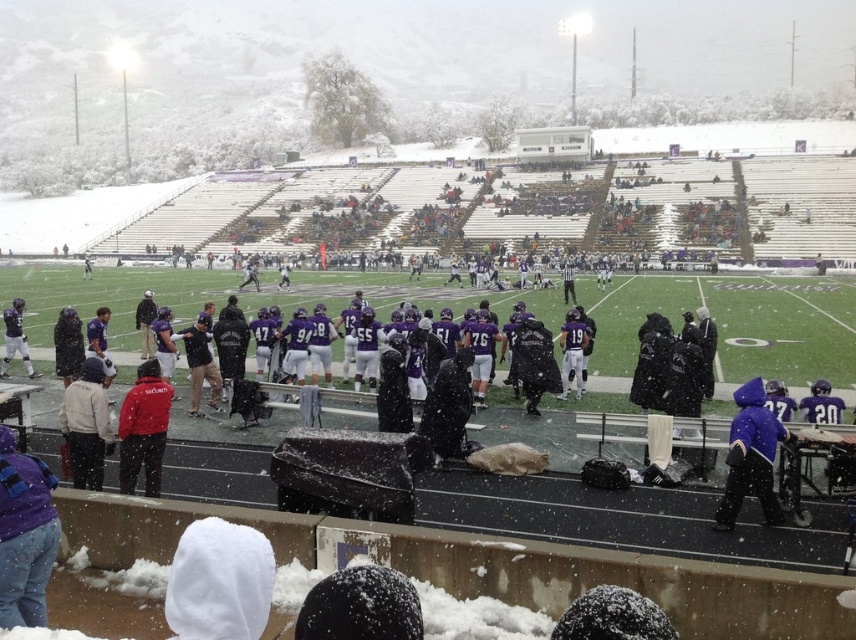
Consider the image. Is white fleece jacket at lower left bigger than matte purple jersey at center?

Yes.

Does point (79, 440) come behind point (578, 376)?

No, (79, 440) is in front of (578, 376).

Who is more forward, (97, 438) or (577, 312)?

Point (97, 438) is more forward.

Find the location of a particular element. The height and width of the screenshot is (640, 856). white fleece jacket at lower left is located at coordinates tap(86, 426).

Describe the element at coordinates (24, 534) in the screenshot. I see `purple fleece jacket at lower left` at that location.

Locate an element on the screen. This screenshot has height=640, width=856. purple fleece jacket at lower left is located at coordinates (24, 534).

Measure the distance between purple fleece jacket at lower left and camera.

The distance of purple fleece jacket at lower left from camera is 9.71 meters.

At what (x,y) coordinates should I click in order to perform the action: click on purple fleece jacket at lower left. Please return your answer as a coordinate pair (x, y). The height and width of the screenshot is (640, 856). Looking at the image, I should click on (24, 534).

Identify the location of purple matte jacket at lower right. (750, 456).

Which is in front, point (734, 435) or point (122, 406)?

Point (734, 435) is in front.

Where is `purple matte jacket at lower right`? The height and width of the screenshot is (640, 856). purple matte jacket at lower right is located at coordinates (750, 456).